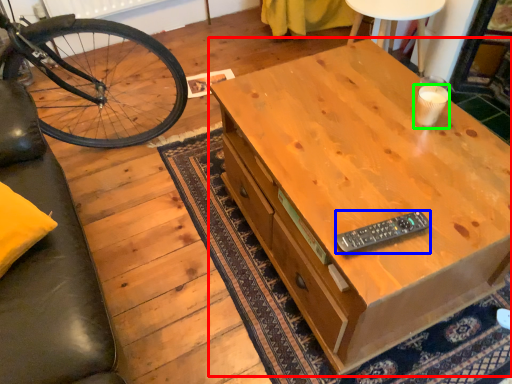
Question: Considering the real-world distances, which object is farthest from desk (highlighted by a red box)? remote control (highlighted by a blue box) or coffee cup (highlighted by a green box)?

Choices:
 (A) remote control
 (B) coffee cup

Answer: (B)